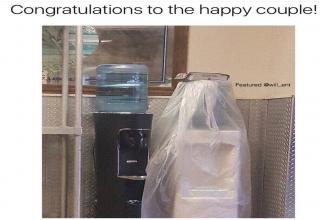
The image size is (320, 220). Find the location of `glass`. glass is located at coordinates (133, 43).